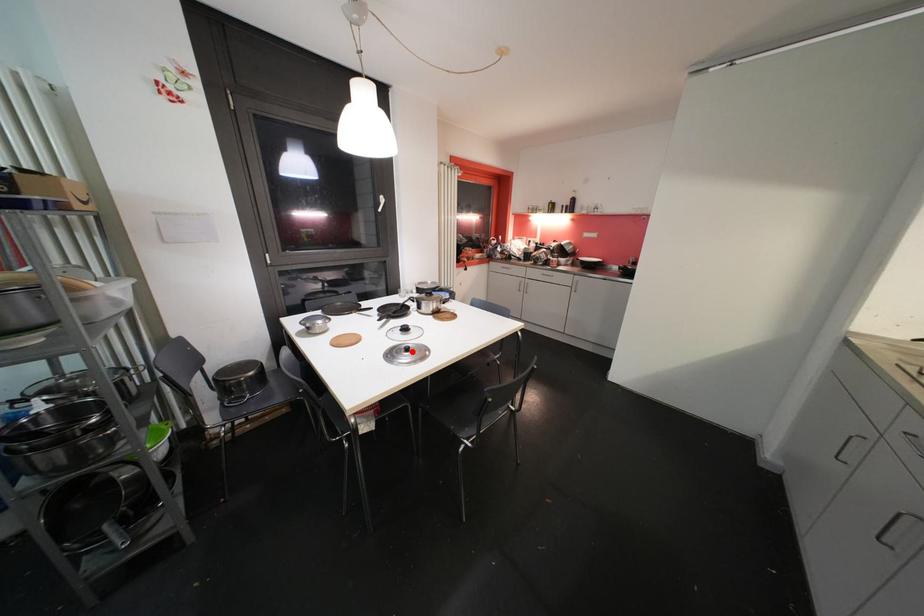
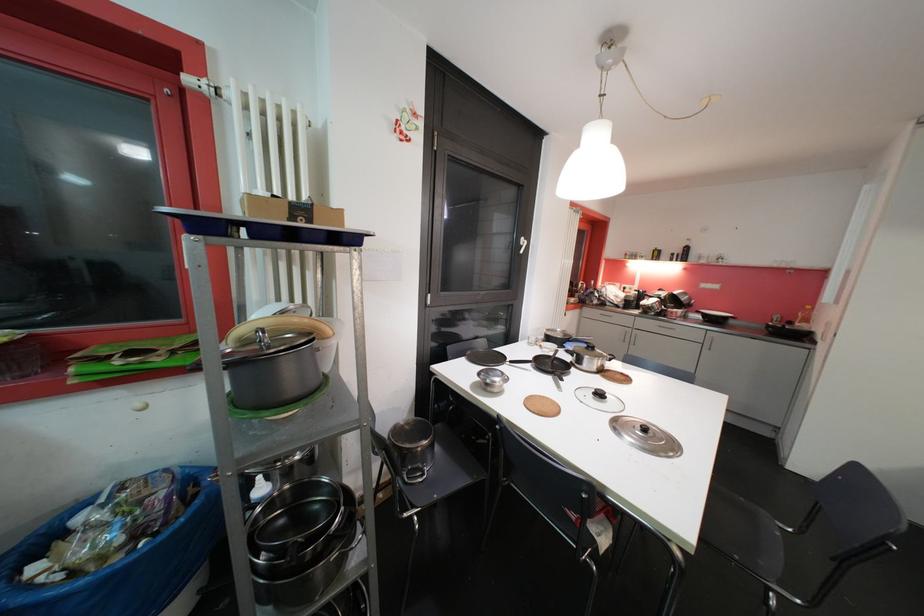
In the second image, find the point that corresponds to the highlighted location in the first image.

(650, 432)